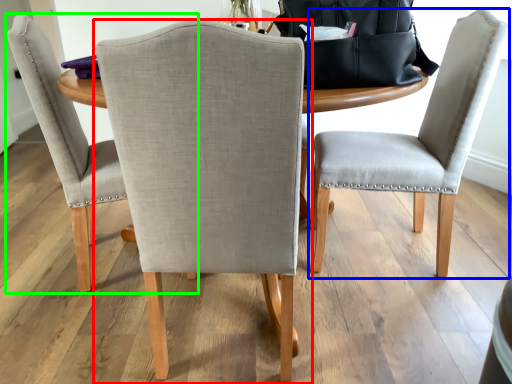
Question: Based on their relative distances, which object is farther from chair (highlighted by a red box)? Choose from chair (highlighted by a blue box) and chair (highlighted by a green box).

Choices:
 (A) chair
 (B) chair

Answer: (A)